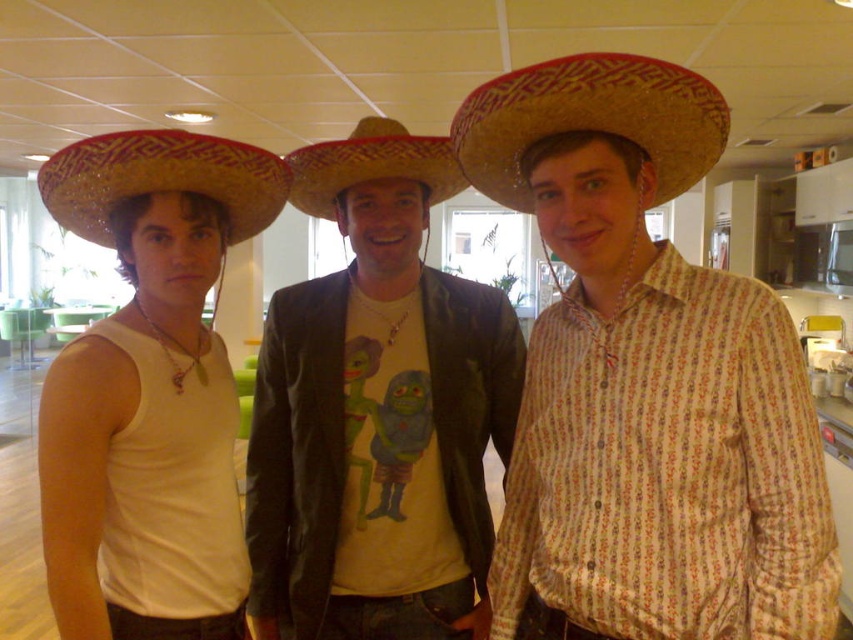
Question: Which point appears closest to the camera in this image?

Choices:
 (A) (276, 202)
 (B) (267, 595)
 (C) (566, 97)

Answer: (C)

Question: Does matte straw sombrero at center have a greater width compared to matte brown leather jacket at center?

Choices:
 (A) no
 (B) yes

Answer: (A)

Question: Is matte brown leather jacket at center smaller than matte straw sombrero at left?

Choices:
 (A) yes
 (B) no

Answer: (B)

Question: Which point is closer to the camera?

Choices:
 (A) (138, 164)
 (B) (329, 304)

Answer: (A)

Question: Does matte straw sombrero at center have a greater width compared to bright straw sombrero at left?

Choices:
 (A) yes
 (B) no

Answer: (B)

Question: Among these objects, which one is nearest to the camera?

Choices:
 (A) bright straw sombrero at left
 (B) straw woven sombrero at center
 (C) matte straw sombrero at left

Answer: (C)